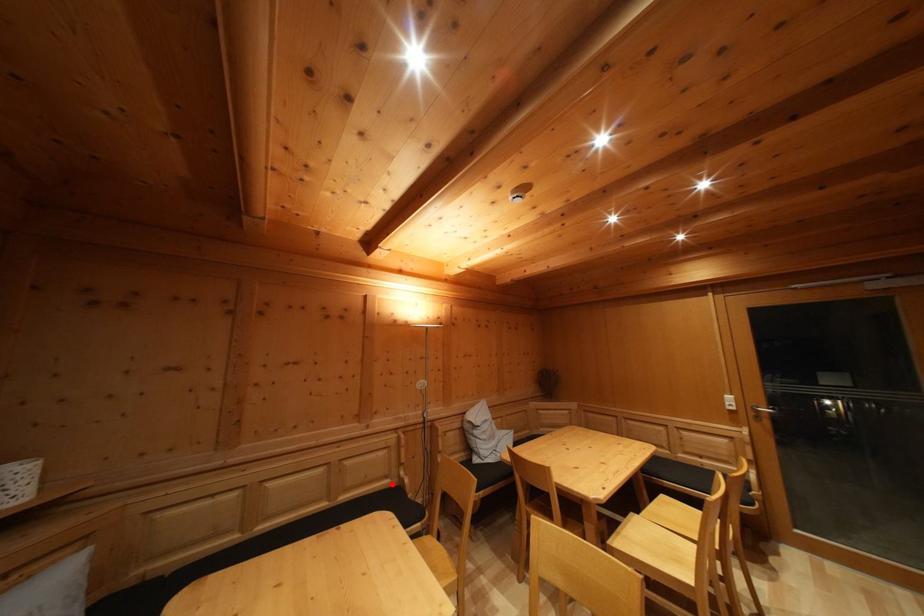
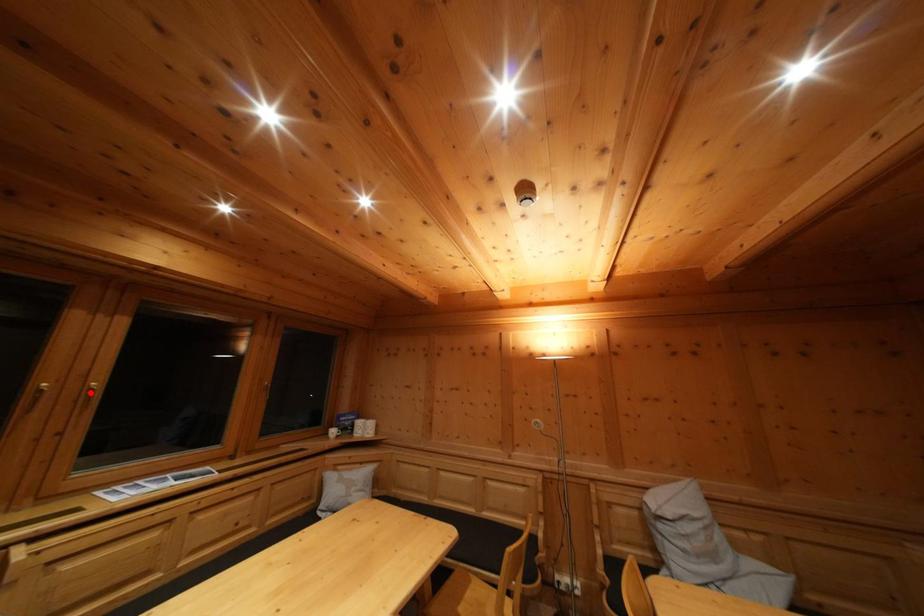
I am providing you with two images of the same scene from different viewpoints. A red point is marked on the first image and another point is marked on the second image. Do the highlighted points in image1 and image2 indicate the same real-world spot?

No